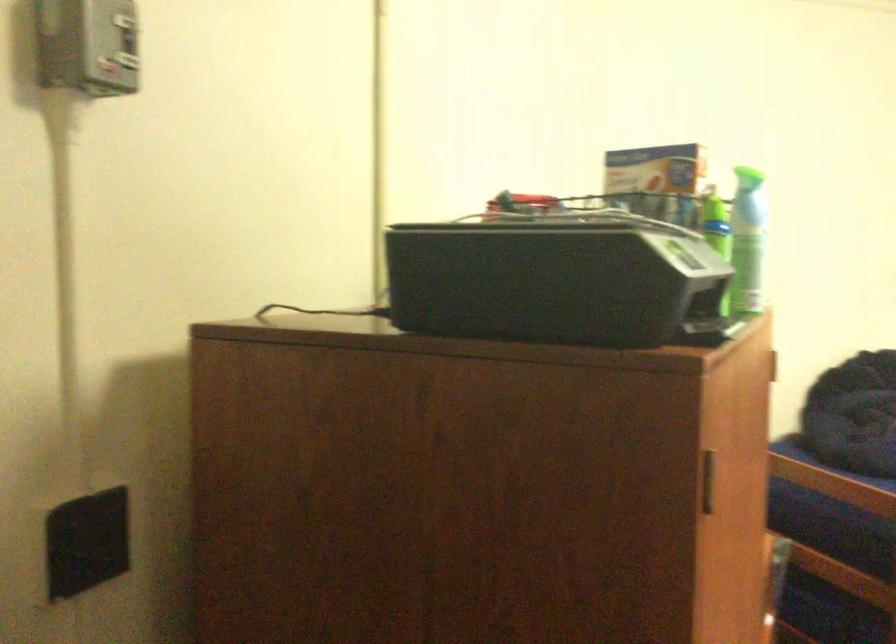
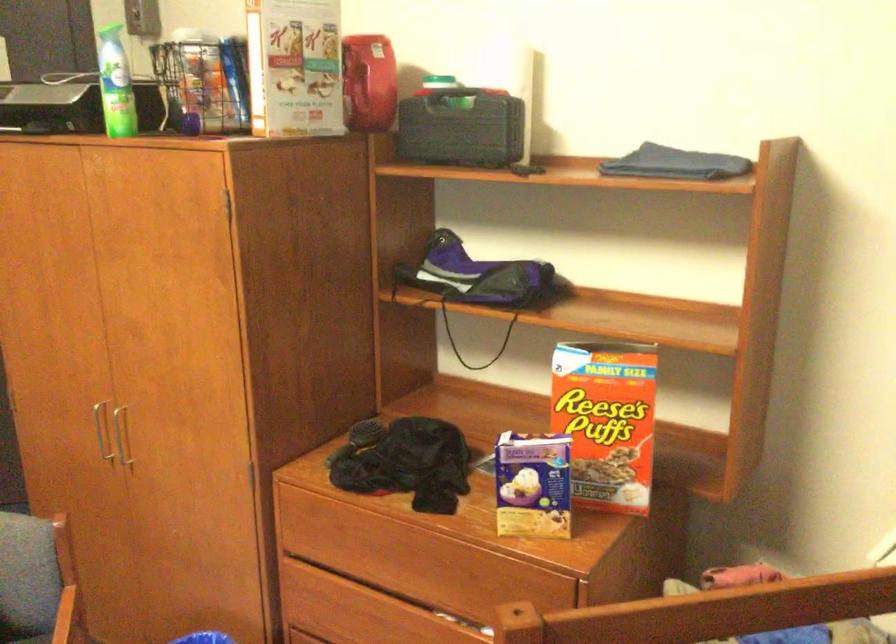
In the second image, find the point that corresponds to (x=642, y=213) in the first image.

(295, 67)